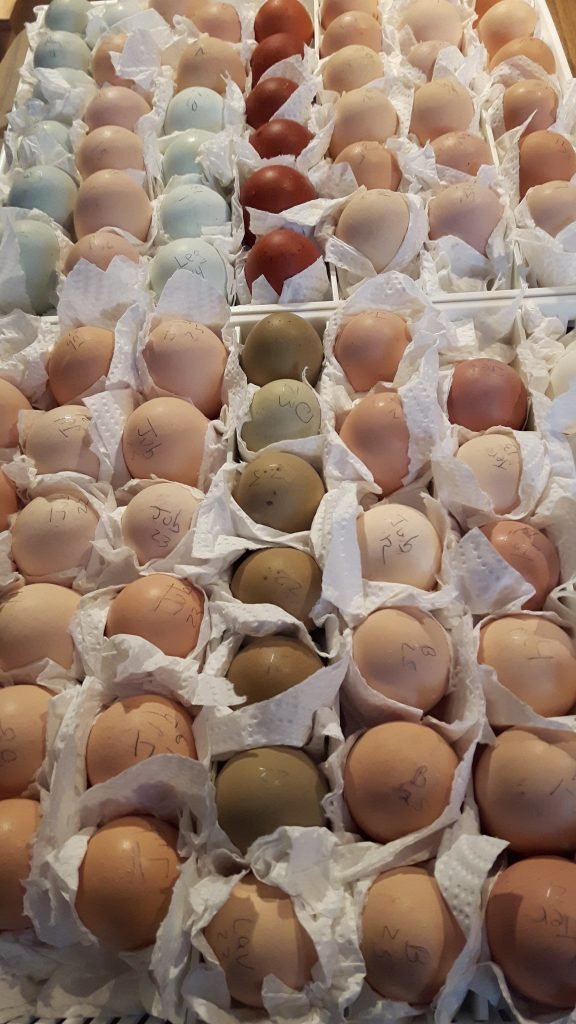
This screenshot has width=576, height=1024. Identify the location of table under eggs. (6, 71).